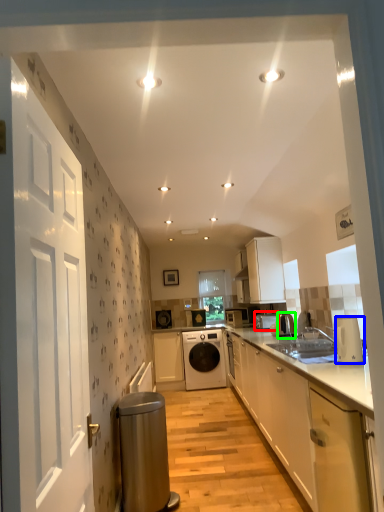
Question: Which object is positioned farthest from appliance (highlighted by a red box)? Select from kitchen appliance (highlighted by a blue box) and appliance (highlighted by a green box).

Choices:
 (A) kitchen appliance
 (B) appliance

Answer: (A)